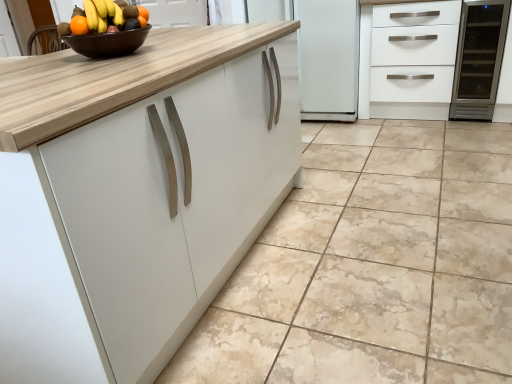
Question: Considering the relative sizes of brown glossy bowl at upper center and orange matte grapefruit at upper left in the image provided, is brown glossy bowl at upper center smaller than orange matte grapefruit at upper left?

Choices:
 (A) yes
 (B) no

Answer: (A)

Question: Considering the relative sizes of brown glossy bowl at upper center and orange matte grapefruit at upper left in the image provided, is brown glossy bowl at upper center shorter than orange matte grapefruit at upper left?

Choices:
 (A) no
 (B) yes

Answer: (B)

Question: Is brown glossy bowl at upper center outside of orange matte grapefruit at upper left?

Choices:
 (A) no
 (B) yes

Answer: (B)

Question: Is brown glossy bowl at upper center further to camera compared to orange matte grapefruit at upper left?

Choices:
 (A) no
 (B) yes

Answer: (B)

Question: From the image's perspective, is brown glossy bowl at upper center on top of orange matte grapefruit at upper left?

Choices:
 (A) no
 (B) yes

Answer: (A)

Question: Is point (508, 46) positioned closer to the camera than point (115, 23)?

Choices:
 (A) closer
 (B) farther

Answer: (B)

Question: From the image's perspective, relative to orange matte grapefruit at upper left, is white matte cabinet at upper right above or below?

Choices:
 (A) above
 (B) below

Answer: (A)

Question: Relative to orange matte grapefruit at upper left, is white matte cabinet at upper right in front or behind?

Choices:
 (A) front
 (B) behind

Answer: (B)

Question: In the image, is white matte cabinet at upper right on the left side or the right side of orange matte grapefruit at upper left?

Choices:
 (A) right
 (B) left

Answer: (A)

Question: Is white matte cabinet at upper right situated inside beige marble floor at center or outside?

Choices:
 (A) outside
 (B) inside

Answer: (A)

Question: Considering their positions, is white matte cabinet at upper right located in front of or behind beige marble floor at center?

Choices:
 (A) behind
 (B) front

Answer: (A)

Question: From the image's perspective, is white matte cabinet at upper right located above or below beige marble floor at center?

Choices:
 (A) above
 (B) below

Answer: (A)

Question: Based on their sizes in the image, would you say white matte cabinet at upper right is bigger or smaller than beige marble floor at center?

Choices:
 (A) big
 (B) small

Answer: (B)

Question: From the image's perspective, relative to brown glossy bowl at upper center, is orange matte grapefruit at upper left above or below?

Choices:
 (A) above
 (B) below

Answer: (A)

Question: In terms of width, does orange matte grapefruit at upper left look wider or thinner when compared to brown glossy bowl at upper center?

Choices:
 (A) thin
 (B) wide

Answer: (A)